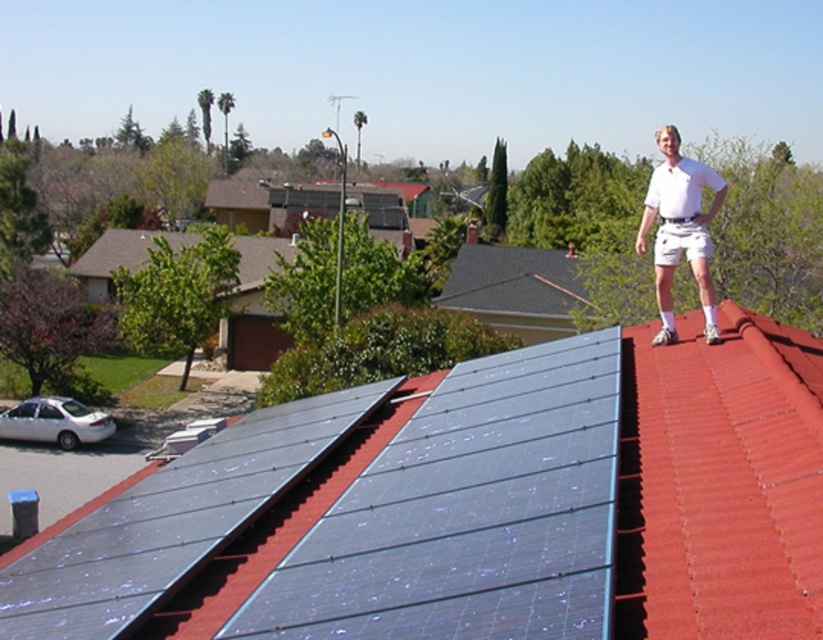
Is the position of blue glossy solar panel at center less distant than that of white cotton shirt at upper right?

Yes.

Does point (452, 632) come in front of point (677, 170)?

Yes, it is.

Locate an element on the screen. This screenshot has height=640, width=823. blue glossy solar panel at center is located at coordinates (468, 513).

Which is behind, point (737, 422) or point (596, 538)?

The point (737, 422) is behind.

Who is shorter, blue metallic solar panels at upper center or blue glossy solar panel at center?

blue metallic solar panels at upper center is shorter.

Does point (324, 396) come closer to viewer compared to point (403, 552)?

No, it is behind (403, 552).

Where is `blue metallic solar panels at upper center`? blue metallic solar panels at upper center is located at coordinates (475, 506).

Can you confirm if blue metallic solar panels at upper center is shorter than white cotton shirt at upper right?

Correct, blue metallic solar panels at upper center is not as tall as white cotton shirt at upper right.

Where is `blue metallic solar panels at upper center`? blue metallic solar panels at upper center is located at coordinates (475, 506).

Between point (814, 596) and point (715, 182), which one is positioned in front?

Positioned in front is point (814, 596).

At what (x,y) coordinates should I click in order to perform the action: click on blue metallic solar panels at upper center. Please return your answer as a coordinate pair (x, y). The image size is (823, 640). Looking at the image, I should click on (475, 506).